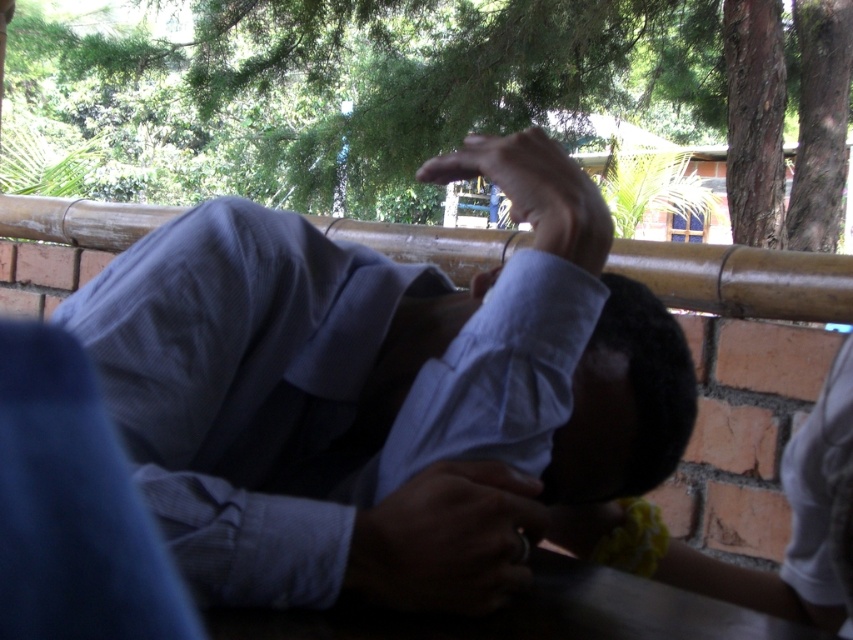
Which is below, light blue shirt at center or metallic ring at lower center?

Positioned lower is metallic ring at lower center.

Does light blue shirt at center appear over metallic ring at lower center?

Yes, light blue shirt at center is above metallic ring at lower center.

Locate an element on the screen. Image resolution: width=853 pixels, height=640 pixels. light blue shirt at center is located at coordinates [381, 392].

Based on the photo, between metallic ring at lower center and matte blue shirt at upper center, which one has more height?

Standing taller between the two is matte blue shirt at upper center.

The image size is (853, 640). I want to click on metallic ring at lower center, so click(x=447, y=540).

Is light blue shirt at center thinner than matte blue shirt at upper center?

No, light blue shirt at center is not thinner than matte blue shirt at upper center.

Is point (286, 301) more distant than point (554, 220)?

That is True.

Where is `light blue shirt at center`? light blue shirt at center is located at coordinates (381, 392).

Identify the location of light blue shirt at center. (381, 392).